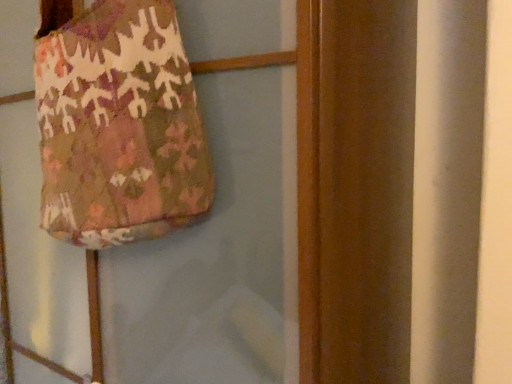
What are the coordinates of `textured fabric bag at upper left` in the screenshot? It's located at (119, 127).

Describe the element at coordinates (119, 127) in the screenshot. I see `textured fabric bag at upper left` at that location.

At what (x,y) coordinates should I click in order to perform the action: click on textured fabric bag at upper left. Please return your answer as a coordinate pair (x, y). The width and height of the screenshot is (512, 384). Looking at the image, I should click on (217, 255).

What do you see at coordinates (217, 255) in the screenshot?
I see `textured fabric bag at upper left` at bounding box center [217, 255].

Measure the distance between point [126,298] and camera.

Point [126,298] is 70.20 centimeters from camera.

Locate an element on the screen. textured fabric bag at upper left is located at coordinates (119, 127).

Considering the positions of objects textured fabric bag at upper left and textured fabric bag at upper left in the image provided, who is more to the left, textured fabric bag at upper left or textured fabric bag at upper left?

From the viewer's perspective, textured fabric bag at upper left appears more on the left side.

Which object is closer to the camera, textured fabric bag at upper left or textured fabric bag at upper left?

textured fabric bag at upper left is closer to the camera.

Which point is more distant from viewer, (188, 156) or (139, 307)?

Point (139, 307)

From the image's perspective, is textured fabric bag at upper left below textured fabric bag at upper left?

No, from the image's perspective, textured fabric bag at upper left is not beneath textured fabric bag at upper left.

From a real-world perspective, is textured fabric bag at upper left under textured fabric bag at upper left?

No, from a real-world perspective, textured fabric bag at upper left is not under textured fabric bag at upper left.

Is textured fabric bag at upper left wider than textured fabric bag at upper left?

No.

Considering the sizes of objects textured fabric bag at upper left and textured fabric bag at upper left in the image provided, who is taller, textured fabric bag at upper left or textured fabric bag at upper left?

Standing taller between the two is textured fabric bag at upper left.

Which of these two, textured fabric bag at upper left or textured fabric bag at upper left, is bigger?

textured fabric bag at upper left.

Is textured fabric bag at upper left inside the boundaries of textured fabric bag at upper left, or outside?

textured fabric bag at upper left is located inside textured fabric bag at upper left.

Is the surface of textured fabric bag at upper left in direct contact with textured fabric bag at upper left?

No, textured fabric bag at upper left is not touching textured fabric bag at upper left.

Is textured fabric bag at upper left turned away from textured fabric bag at upper left?

Yes, textured fabric bag at upper left is facing away from textured fabric bag at upper left.

What's the angular difference between textured fabric bag at upper left and textured fabric bag at upper left's facing directions?

13.4 degrees separate the facing orientations of textured fabric bag at upper left and textured fabric bag at upper left.

How far apart are textured fabric bag at upper left and textured fabric bag at upper left?

5.50 inches.

The height and width of the screenshot is (384, 512). Find the location of `handbag behind the textured fabric bag at upper left`. handbag behind the textured fabric bag at upper left is located at coordinates (119, 127).

Based on their positions, is textured fabric bag at upper left located to the left or right of textured fabric bag at upper left?

textured fabric bag at upper left is to the right of textured fabric bag at upper left.

Considering the positions of objects textured fabric bag at upper left and textured fabric bag at upper left in the image provided, who is in front, textured fabric bag at upper left or textured fabric bag at upper left?

textured fabric bag at upper left is in front.

Does point (291, 102) appear closer or farther from the camera than point (46, 169)?

Point (291, 102) appears to be closer to the viewer than point (46, 169).

From the image's perspective, is textured fabric bag at upper left beneath textured fabric bag at upper left?

Yes, from the image's perspective, textured fabric bag at upper left is beneath textured fabric bag at upper left.

From a real-world perspective, between textured fabric bag at upper left and textured fabric bag at upper left, who is vertically lower?

textured fabric bag at upper left.

Can you confirm if textured fabric bag at upper left is wider than textured fabric bag at upper left?

Yes.

Between textured fabric bag at upper left and textured fabric bag at upper left, which one has more height?

With more height is textured fabric bag at upper left.

Considering the relative sizes of textured fabric bag at upper left and textured fabric bag at upper left in the image provided, is textured fabric bag at upper left smaller than textured fabric bag at upper left?

No, textured fabric bag at upper left is not smaller than textured fabric bag at upper left.

Is textured fabric bag at upper left completely or partially outside of textured fabric bag at upper left?

Yes, textured fabric bag at upper left is not within textured fabric bag at upper left.

Is textured fabric bag at upper left directly adjacent to textured fabric bag at upper left?

textured fabric bag at upper left and textured fabric bag at upper left are clearly separated.

Is textured fabric bag at upper left at the back of textured fabric bag at upper left?

Yes, textured fabric bag at upper left is positioned with its back facing textured fabric bag at upper left.

What's the angular difference between textured fabric bag at upper left and textured fabric bag at upper left's facing directions?

13.4 degrees.

How distant is textured fabric bag at upper left from textured fabric bag at upper left?

5.50 inches.

The height and width of the screenshot is (384, 512). I want to click on handbag lying behind the textured fabric bag at upper left, so click(x=119, y=127).

Image resolution: width=512 pixels, height=384 pixels. I want to click on screen door on the right of textured fabric bag at upper left, so click(217, 255).

At what (x,y) coordinates should I click in order to perform the action: click on screen door below the textured fabric bag at upper left (from the image's perspective). Please return your answer as a coordinate pair (x, y). Looking at the image, I should click on (217, 255).